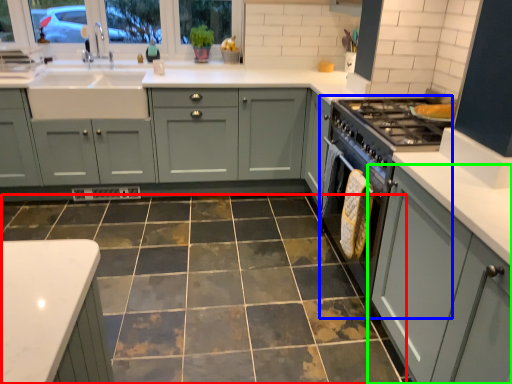
Question: Which object is the farthest from ceramic tile (highlighted by a red box)? Choose among these: appliance (highlighted by a blue box) or cabinetry (highlighted by a green box).

Choices:
 (A) appliance
 (B) cabinetry

Answer: (B)